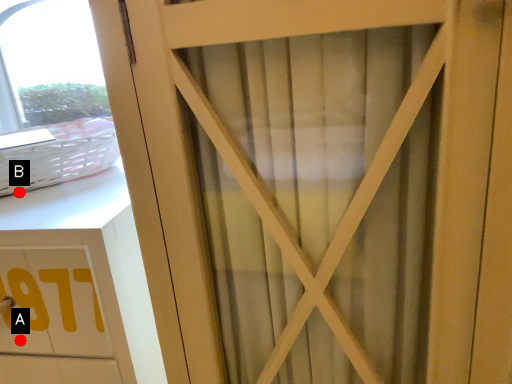
Question: Two points are circled on the image, labeled by A and B beside each circle. Which of the following is the farthest from the observer?

Choices:
 (A) A is further
 (B) B is further

Answer: (B)